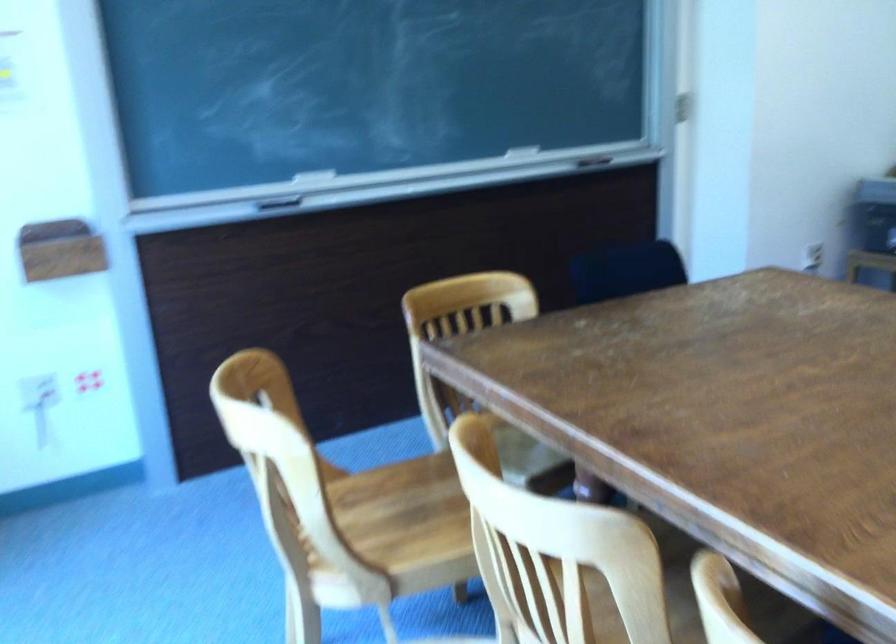
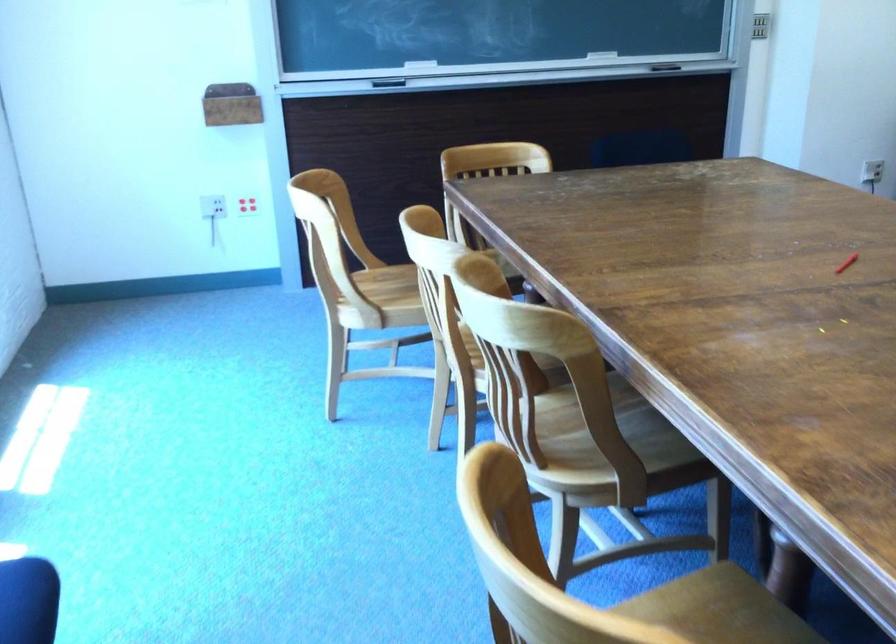
Where in the second image is the point corresponding to pixel 367 514 from the first image?

(393, 286)